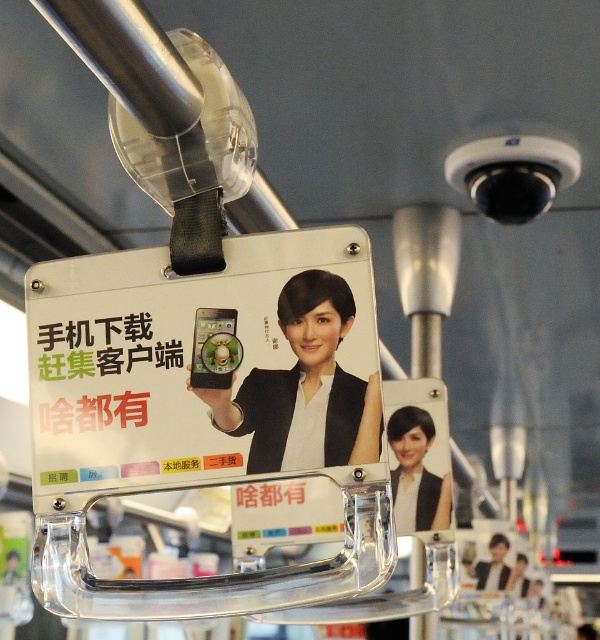
Question: Which of the following is the farthest from the observer?

Choices:
 (A) (294, 294)
 (B) (430, 506)

Answer: (B)

Question: Does matte black phone at center appear on the right side of matte black jacket at center?

Choices:
 (A) no
 (B) yes

Answer: (A)

Question: Is matte black phone at center smaller than matte black jacket at center?

Choices:
 (A) yes
 (B) no

Answer: (B)

Question: In this image, where is matte black phone at center located relative to matte black jacket at center?

Choices:
 (A) left
 (B) right

Answer: (A)

Question: Which of the following is the closest to the observer?

Choices:
 (A) matte black phone at center
 (B) matte black jacket at center

Answer: (A)